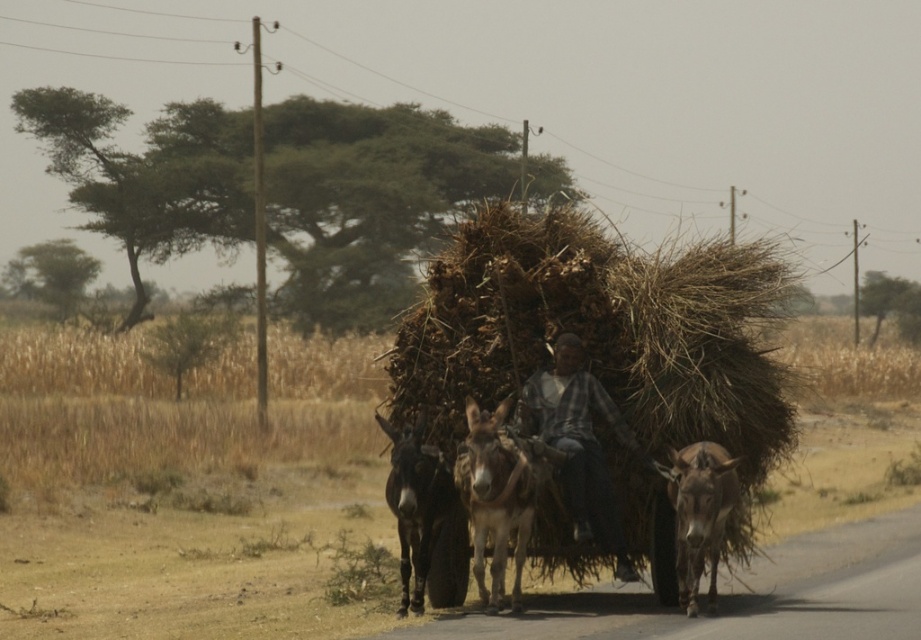
Question: Which of the following is the closest to the observer?

Choices:
 (A) plaid fabric shirt at center
 (B) brown rough donkey at center
 (C) brown rough textured mule at center
 (D) dark brown fur mule at center

Answer: (B)

Question: Is plaid fabric shirt at center wider than brown rough donkey at center?

Choices:
 (A) yes
 (B) no

Answer: (A)

Question: Can you confirm if dark brown fur mule at center is thinner than brown rough textured mule at center?

Choices:
 (A) no
 (B) yes

Answer: (A)

Question: Which object is positioned closest to the brown rough donkey at center?

Choices:
 (A) brown rough textured mule at center
 (B) dark brown fur mule at center

Answer: (B)

Question: Does brown rough donkey at center appear on the right side of brown rough textured mule at center?

Choices:
 (A) no
 (B) yes

Answer: (A)

Question: Which point is closer to the camera?

Choices:
 (A) brown rough textured mule at center
 (B) dark brown fur mule at center
 (C) plaid fabric shirt at center
 (D) brown rough donkey at center

Answer: (D)